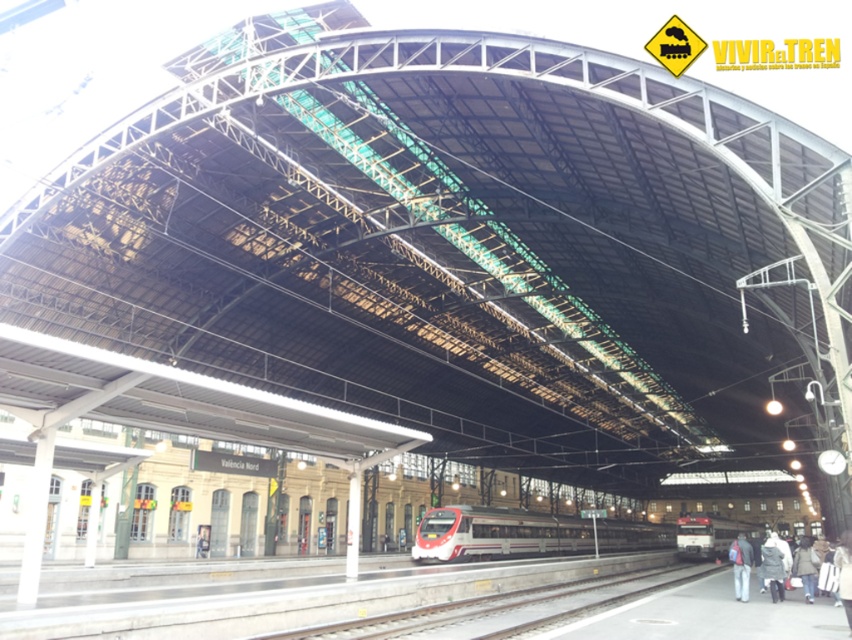
Is white glossy train at center wider than dark gray jacket at lower right?

Yes.

Between white glossy train at center and dark gray jacket at lower right, which one has less height?

With less height is white glossy train at center.

Does point (586, 541) come closer to viewer compared to point (728, 552)?

No, it is behind (728, 552).

Identify the location of white glossy train at center. This screenshot has width=852, height=640. (x=525, y=532).

Does white fuzzy coat at lower right have a greater height compared to dark gray jacket at lower right?

In fact, white fuzzy coat at lower right may be shorter than dark gray jacket at lower right.

Does point (775, 566) come in front of point (738, 566)?

Yes, point (775, 566) is in front of point (738, 566).

Find the location of a particular element. Image resolution: width=852 pixels, height=640 pixels. white fuzzy coat at lower right is located at coordinates (772, 566).

Find the location of `white glossy train at center`. white glossy train at center is located at coordinates (525, 532).

Who is more distant from viewer, (476, 534) or (684, 534)?

The point (684, 534) is behind.

Identify the location of white glossy train at center. pos(525,532).